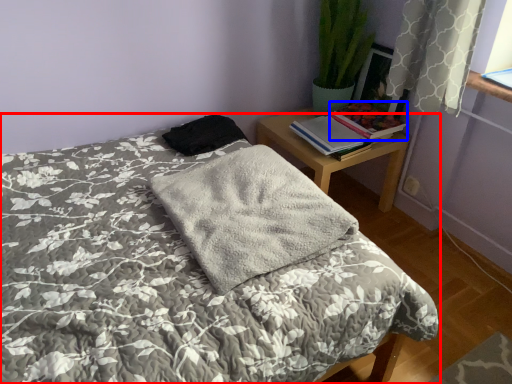
Question: Which point is closer to the camera, bed (highlighted by a red box) or book (highlighted by a blue box)?

Choices:
 (A) bed
 (B) book

Answer: (A)